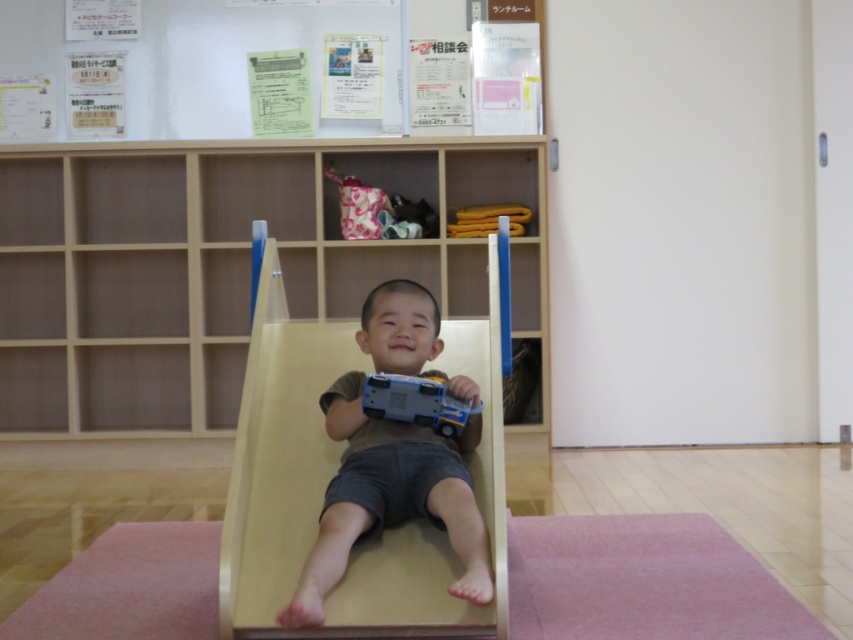
Question: Is pink carpet at lower center wider than shiny blue plastic toy car at center?

Choices:
 (A) no
 (B) yes

Answer: (B)

Question: Based on their relative distances, which object is nearer to the light brown wooden slide at center?

Choices:
 (A) wooden bookshelf at center
 (B) shiny blue plastic toy car at center
 (C) pink carpet at lower center

Answer: (B)

Question: Is shiny blue plastic toy car at center below yellow fabric at upper center?

Choices:
 (A) yes
 (B) no

Answer: (A)

Question: Which object is closer to the camera taking this photo?

Choices:
 (A) pink carpet at lower center
 (B) yellow fabric at upper center
 (C) light brown wooden slide at center
 (D) shiny blue plastic toy car at center

Answer: (C)

Question: Which point is closer to the camera?

Choices:
 (A) light brown wooden slide at center
 (B) yellow fabric at upper center
 (C) shiny blue plastic toy car at center
 (D) pink carpet at lower center

Answer: (A)

Question: Can you confirm if pink carpet at lower center is positioned above shiny blue plastic toy car at center?

Choices:
 (A) no
 (B) yes

Answer: (A)